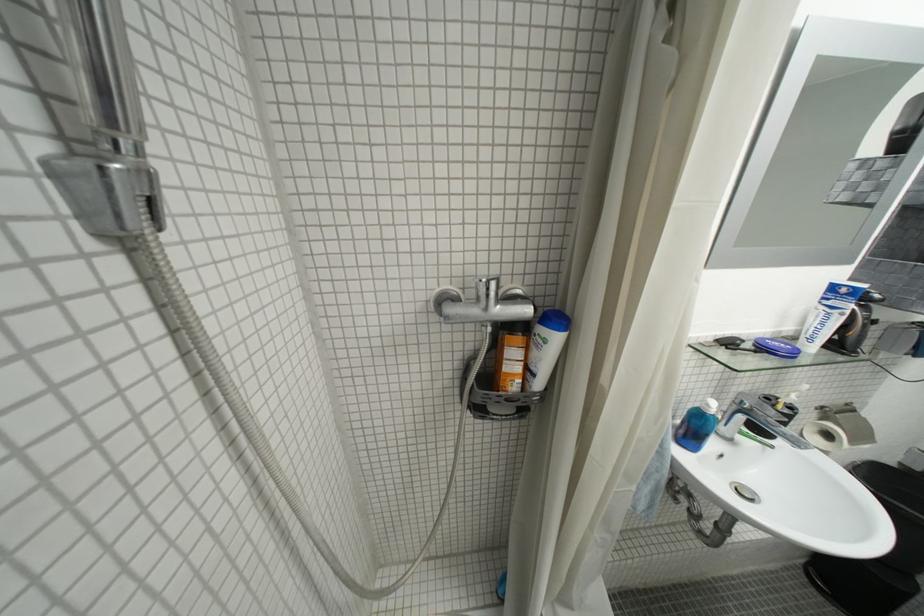
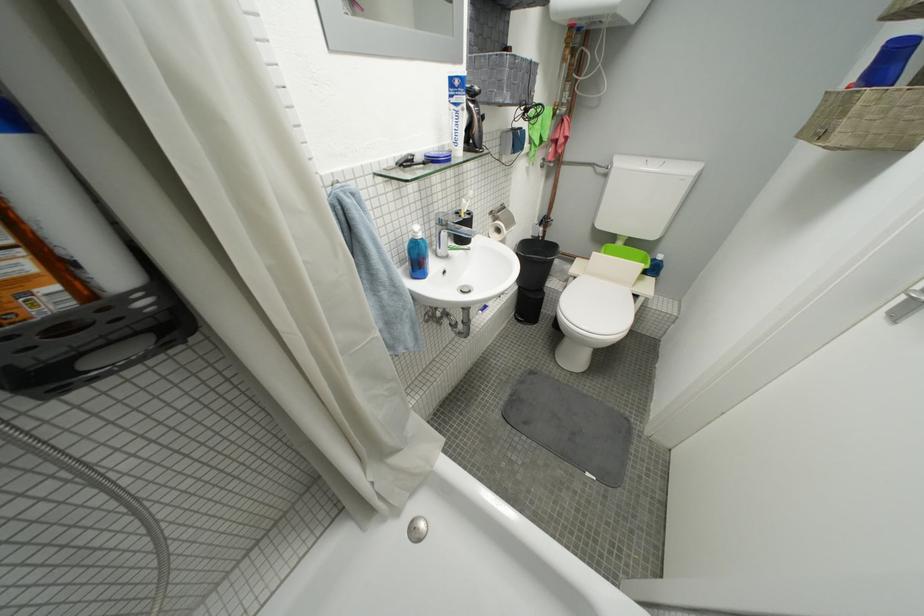
Locate, in the second image, the point that corresponds to (810,575) in the first image.

(523, 322)